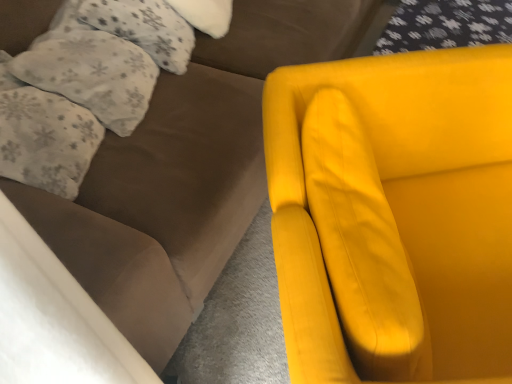
What do you see at coordinates (44, 136) in the screenshot?
I see `fluffy white pillow at upper left, which ranks as the 1th pillow in bottom-to-top order` at bounding box center [44, 136].

How much space does fluffy white pillow at upper left, acting as the third pillow starting from the bottom, occupy vertically?

The height of fluffy white pillow at upper left, acting as the third pillow starting from the bottom, is 30.60 centimeters.

Image resolution: width=512 pixels, height=384 pixels. Describe the element at coordinates (92, 74) in the screenshot. I see `white fluffy pillow at upper left, the second pillow when ordered from bottom to top` at that location.

Where is `fluffy white pillow at upper left, the third pillow from the top`? Image resolution: width=512 pixels, height=384 pixels. fluffy white pillow at upper left, the third pillow from the top is located at coordinates (44, 136).

Which is behind, white fluffy pillow at upper left, the second pillow when ordered from bottom to top, or matte yellow armchair at right?

Positioned behind is white fluffy pillow at upper left, the second pillow when ordered from bottom to top.

Measure the distance between white fluffy pillow at upper left, the second pillow when ordered from bottom to top, and matte yellow armchair at right.

white fluffy pillow at upper left, the second pillow when ordered from bottom to top, and matte yellow armchair at right are 27.41 inches apart from each other.

Does white fluffy pillow at upper left, the second pillow when ordered from bottom to top, turn towards matte yellow armchair at right?

Yes, white fluffy pillow at upper left, the second pillow when ordered from bottom to top, is oriented towards matte yellow armchair at right.

Does fluffy white pillow at upper left, which ranks as the 1th pillow in bottom-to-top order, have a larger size compared to fluffy white pillow at upper left, acting as the third pillow starting from the bottom?

Yes.

Consider the image. Does fluffy white pillow at upper left, the third pillow from the top, have a greater width compared to fluffy white pillow at upper left, acting as the third pillow starting from the bottom?

Indeed, fluffy white pillow at upper left, the third pillow from the top, has a greater width compared to fluffy white pillow at upper left, acting as the third pillow starting from the bottom.

What's the angular difference between fluffy white pillow at upper left, the third pillow from the top, and fluffy white pillow at upper left, which is the first pillow from top to bottom,'s facing directions?

fluffy white pillow at upper left, the third pillow from the top, and fluffy white pillow at upper left, which is the first pillow from top to bottom, are facing 0.147 degrees away from each other.

Looking at this image, could matte yellow armchair at right be considered to be inside fluffy white pillow at upper left, which ranks as the 1th pillow in bottom-to-top order?

No, matte yellow armchair at right is not surrounded by fluffy white pillow at upper left, which ranks as the 1th pillow in bottom-to-top order.

Who is shorter, fluffy white pillow at upper left, which ranks as the 1th pillow in bottom-to-top order, or matte yellow armchair at right?

Standing shorter between the two is fluffy white pillow at upper left, which ranks as the 1th pillow in bottom-to-top order.

From the image's perspective, between fluffy white pillow at upper left, the third pillow from the top, and matte yellow armchair at right, which one is located above?

From the image's view, fluffy white pillow at upper left, the third pillow from the top, is above.

At what (x,y) coordinates should I click in order to perform the action: click on chair on the right of fluffy white pillow at upper left, the third pillow from the top. Please return your answer as a coordinate pair (x, y). Image resolution: width=512 pixels, height=384 pixels. Looking at the image, I should click on (x=394, y=213).

From a real-world perspective, relative to fluffy white pillow at upper left, acting as the third pillow starting from the bottom, is white fluffy pillow at upper left, the second pillow positioned from the top, vertically above or below?

white fluffy pillow at upper left, the second pillow positioned from the top, is above fluffy white pillow at upper left, acting as the third pillow starting from the bottom.

Based on the photo, does white fluffy pillow at upper left, the second pillow positioned from the top, touch fluffy white pillow at upper left, which is the first pillow from top to bottom?

white fluffy pillow at upper left, the second pillow positioned from the top, and fluffy white pillow at upper left, which is the first pillow from top to bottom, are not in contact.

Considering the relative positions of white fluffy pillow at upper left, the second pillow when ordered from bottom to top, and fluffy white pillow at upper left, acting as the third pillow starting from the bottom, in the image provided, is white fluffy pillow at upper left, the second pillow when ordered from bottom to top, to the left or to the right of fluffy white pillow at upper left, acting as the third pillow starting from the bottom,?

Clearly, white fluffy pillow at upper left, the second pillow when ordered from bottom to top, is on the left of fluffy white pillow at upper left, acting as the third pillow starting from the bottom, in the image.

Which of these two, white fluffy pillow at upper left, the second pillow when ordered from bottom to top, or fluffy white pillow at upper left, which is the first pillow from top to bottom, is thinner?

With smaller width is white fluffy pillow at upper left, the second pillow when ordered from bottom to top.

Where is `the 1st pillow below when counting from the fluffy white pillow at upper left, which is the first pillow from top to bottom (from the image's perspective)`? the 1st pillow below when counting from the fluffy white pillow at upper left, which is the first pillow from top to bottom (from the image's perspective) is located at coordinates (92, 74).

Which point is more forward, (x=80, y=13) or (x=141, y=117)?

Positioned in front is point (x=141, y=117).

From the image's perspective, between fluffy white pillow at upper left, which is the first pillow from top to bottom, and white fluffy pillow at upper left, the second pillow when ordered from bottom to top, which one is located above?

fluffy white pillow at upper left, which is the first pillow from top to bottom.

Is fluffy white pillow at upper left, acting as the third pillow starting from the bottom, further to the viewer compared to white fluffy pillow at upper left, the second pillow when ordered from bottom to top?

Yes, it is behind white fluffy pillow at upper left, the second pillow when ordered from bottom to top.

Are fluffy white pillow at upper left, which is the first pillow from top to bottom, and fluffy white pillow at upper left, the third pillow from the top, far apart?

No.

Based on their positions, is fluffy white pillow at upper left, which is the first pillow from top to bottom, located to the left or right of fluffy white pillow at upper left, the third pillow from the top?

In the image, fluffy white pillow at upper left, which is the first pillow from top to bottom, appears on the right side of fluffy white pillow at upper left, the third pillow from the top.

Locate an element on the screen. The width and height of the screenshot is (512, 384). the 2nd pillow in front of the fluffy white pillow at upper left, which is the first pillow from top to bottom, starting your count from the anchor is located at coordinates [x=44, y=136].

Consider the image. Is fluffy white pillow at upper left, acting as the third pillow starting from the bottom, behind fluffy white pillow at upper left, the third pillow from the top?

Yes, fluffy white pillow at upper left, acting as the third pillow starting from the bottom, is further from the camera.

Is white fluffy pillow at upper left, the second pillow when ordered from bottom to top, positioned in front of fluffy white pillow at upper left, which ranks as the 1th pillow in bottom-to-top order?

No, it is behind fluffy white pillow at upper left, which ranks as the 1th pillow in bottom-to-top order.

I want to click on pillow below the white fluffy pillow at upper left, the second pillow when ordered from bottom to top (from the image's perspective), so click(x=44, y=136).

Which of these two, white fluffy pillow at upper left, the second pillow when ordered from bottom to top, or fluffy white pillow at upper left, the third pillow from the top, is thinner?

white fluffy pillow at upper left, the second pillow when ordered from bottom to top, is thinner.

Locate an element on the screen. the 2nd pillow counting from the left side of the matte yellow armchair at right is located at coordinates (92, 74).

You are a GUI agent. You are given a task and a screenshot of the screen. Output one action in this format:
    pyautogui.click(x=<x>, y=<y>)
    Task: Click on the 2nd pillow above the fluffy white pillow at upper left, the third pillow from the top (from the image's perspective)
    This screenshot has width=512, height=384.
    Given the screenshot: What is the action you would take?
    pyautogui.click(x=144, y=28)

Considering their positions, is matte yellow armchair at right positioned closer to fluffy white pillow at upper left, the third pillow from the top, than white fluffy pillow at upper left, the second pillow when ordered from bottom to top?

white fluffy pillow at upper left, the second pillow when ordered from bottom to top, is positioned closer to the anchor fluffy white pillow at upper left, the third pillow from the top.

Estimate the real-world distances between objects in this image. Which object is closer to white fluffy pillow at upper left, the second pillow when ordered from bottom to top, fluffy white pillow at upper left, acting as the third pillow starting from the bottom, or fluffy white pillow at upper left, which ranks as the 1th pillow in bottom-to-top order?

Among the two, fluffy white pillow at upper left, which ranks as the 1th pillow in bottom-to-top order, is located nearer to white fluffy pillow at upper left, the second pillow when ordered from bottom to top.

Looking at the image, which one is located further to fluffy white pillow at upper left, which is the first pillow from top to bottom, matte yellow armchair at right or fluffy white pillow at upper left, the third pillow from the top?

matte yellow armchair at right is further to fluffy white pillow at upper left, which is the first pillow from top to bottom.

In the scene shown: Looking at the image, which one is located closer to white fluffy pillow at upper left, the second pillow positioned from the top, fluffy white pillow at upper left, which ranks as the 1th pillow in bottom-to-top order, or matte yellow armchair at right?

Among the two, fluffy white pillow at upper left, which ranks as the 1th pillow in bottom-to-top order, is located nearer to white fluffy pillow at upper left, the second pillow positioned from the top.

When comparing their distances from fluffy white pillow at upper left, the third pillow from the top, does white fluffy pillow at upper left, the second pillow when ordered from bottom to top, or matte yellow armchair at right seem further?

matte yellow armchair at right.

Estimate the real-world distances between objects in this image. Which object is further from fluffy white pillow at upper left, acting as the third pillow starting from the bottom, fluffy white pillow at upper left, which ranks as the 1th pillow in bottom-to-top order, or white fluffy pillow at upper left, the second pillow positioned from the top?

The object further to fluffy white pillow at upper left, acting as the third pillow starting from the bottom, is fluffy white pillow at upper left, which ranks as the 1th pillow in bottom-to-top order.

From the image, which object appears to be nearer to white fluffy pillow at upper left, the second pillow positioned from the top, fluffy white pillow at upper left, which is the first pillow from top to bottom, or matte yellow armchair at right?

Among the two, fluffy white pillow at upper left, which is the first pillow from top to bottom, is located nearer to white fluffy pillow at upper left, the second pillow positioned from the top.

Looking at this image, looking at the image, which one is located further to matte yellow armchair at right, fluffy white pillow at upper left, which ranks as the 1th pillow in bottom-to-top order, or white fluffy pillow at upper left, the second pillow when ordered from bottom to top?

Among the two, fluffy white pillow at upper left, which ranks as the 1th pillow in bottom-to-top order, is located further to matte yellow armchair at right.

Find the location of `pillow between fluffy white pillow at upper left, which is the first pillow from top to bottom, and fluffy white pillow at upper left, the third pillow from the top, vertically`. pillow between fluffy white pillow at upper left, which is the first pillow from top to bottom, and fluffy white pillow at upper left, the third pillow from the top, vertically is located at coordinates (92, 74).

Locate an element on the screen. The width and height of the screenshot is (512, 384). pillow between white fluffy pillow at upper left, the second pillow when ordered from bottom to top, and matte yellow armchair at right is located at coordinates (144, 28).